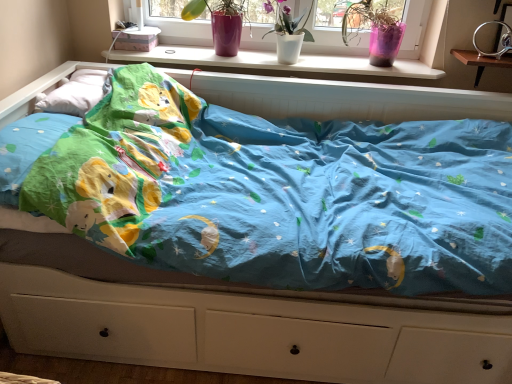
Where is `free point below white matte vase at upper center, which is counted as the 2th floral arrangement, starting from the right (from a real-world perspective)`? free point below white matte vase at upper center, which is counted as the 2th floral arrangement, starting from the right (from a real-world perspective) is located at coordinates (285, 62).